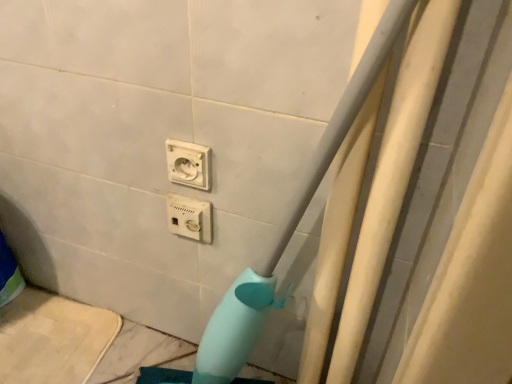
Describe the element at coordinates (189, 217) in the screenshot. I see `white plastic power plugs and sockets at center, the 2th power plugs and sockets positioned from the top` at that location.

Where is `white plastic power plugs and sockets at center, the 1th power plugs and sockets positioned from the bottom`? The height and width of the screenshot is (384, 512). white plastic power plugs and sockets at center, the 1th power plugs and sockets positioned from the bottom is located at coordinates (189, 217).

This screenshot has height=384, width=512. Identify the location of white plastic socket at center, placed as the 1th power plugs and sockets when sorted from top to bottom. tap(188, 164).

What do you see at coordinates (188, 164) in the screenshot? This screenshot has height=384, width=512. I see `white plastic socket at center, which ranks as the 2th power plugs and sockets in bottom-to-top order` at bounding box center [188, 164].

In order to face white plastic socket at center, placed as the 1th power plugs and sockets when sorted from top to bottom, should I rotate leftwards or rightwards?

You should look left and rotate roughly 9.287 degrees.

What is the approximate width of white plastic socket at center, placed as the 1th power plugs and sockets when sorted from top to bottom?

0.85 inches.

The image size is (512, 384). I want to click on white plastic power plugs and sockets at center, the 1th power plugs and sockets positioned from the bottom, so click(189, 217).

Which object is positioned more to the right, white plastic socket at center, placed as the 1th power plugs and sockets when sorted from top to bottom, or white plastic power plugs and sockets at center, the 1th power plugs and sockets positioned from the bottom?

From the viewer's perspective, white plastic socket at center, placed as the 1th power plugs and sockets when sorted from top to bottom, appears more on the right side.

Which object is closer to the camera, white plastic socket at center, placed as the 1th power plugs and sockets when sorted from top to bottom, or white plastic power plugs and sockets at center, the 1th power plugs and sockets positioned from the bottom?

Positioned in front is white plastic socket at center, placed as the 1th power plugs and sockets when sorted from top to bottom.

Does point (178, 179) appear closer or farther from the camera than point (200, 218)?

Point (178, 179) is closer to the camera than point (200, 218).

From the image's perspective, is white plastic socket at center, placed as the 1th power plugs and sockets when sorted from top to bottom, on white plastic power plugs and sockets at center, the 2th power plugs and sockets positioned from the top?

Yes, from the image's perspective, white plastic socket at center, placed as the 1th power plugs and sockets when sorted from top to bottom, is above white plastic power plugs and sockets at center, the 2th power plugs and sockets positioned from the top.

From a real-world perspective, is white plastic socket at center, which ranks as the 2th power plugs and sockets in bottom-to-top order, on top of white plastic power plugs and sockets at center, the 1th power plugs and sockets positioned from the bottom?

Yes, from a real-world perspective, white plastic socket at center, which ranks as the 2th power plugs and sockets in bottom-to-top order, is above white plastic power plugs and sockets at center, the 1th power plugs and sockets positioned from the bottom.

Considering the sizes of white plastic socket at center, which ranks as the 2th power plugs and sockets in bottom-to-top order, and white plastic power plugs and sockets at center, the 1th power plugs and sockets positioned from the bottom, in the image, is white plastic socket at center, which ranks as the 2th power plugs and sockets in bottom-to-top order, wider or thinner than white plastic power plugs and sockets at center, the 1th power plugs and sockets positioned from the bottom,?

In the image, white plastic socket at center, which ranks as the 2th power plugs and sockets in bottom-to-top order, appears to be more narrow than white plastic power plugs and sockets at center, the 1th power plugs and sockets positioned from the bottom.

Considering the relative sizes of white plastic socket at center, placed as the 1th power plugs and sockets when sorted from top to bottom, and white plastic power plugs and sockets at center, the 2th power plugs and sockets positioned from the top, in the image provided, is white plastic socket at center, placed as the 1th power plugs and sockets when sorted from top to bottom, taller than white plastic power plugs and sockets at center, the 2th power plugs and sockets positioned from the top,?

No, white plastic socket at center, placed as the 1th power plugs and sockets when sorted from top to bottom, is not taller than white plastic power plugs and sockets at center, the 2th power plugs and sockets positioned from the top.

Considering the relative sizes of white plastic socket at center, which ranks as the 2th power plugs and sockets in bottom-to-top order, and white plastic power plugs and sockets at center, the 1th power plugs and sockets positioned from the bottom, in the image provided, is white plastic socket at center, which ranks as the 2th power plugs and sockets in bottom-to-top order, smaller than white plastic power plugs and sockets at center, the 1th power plugs and sockets positioned from the bottom,?

Yes, white plastic socket at center, which ranks as the 2th power plugs and sockets in bottom-to-top order, is smaller than white plastic power plugs and sockets at center, the 1th power plugs and sockets positioned from the bottom.

Can we say white plastic socket at center, which ranks as the 2th power plugs and sockets in bottom-to-top order, lies outside white plastic power plugs and sockets at center, the 2th power plugs and sockets positioned from the top?

Indeed, white plastic socket at center, which ranks as the 2th power plugs and sockets in bottom-to-top order, is completely outside white plastic power plugs and sockets at center, the 2th power plugs and sockets positioned from the top.

Are white plastic socket at center, which ranks as the 2th power plugs and sockets in bottom-to-top order, and white plastic power plugs and sockets at center, the 2th power plugs and sockets positioned from the top, making contact?

Yes, white plastic socket at center, which ranks as the 2th power plugs and sockets in bottom-to-top order, is beside white plastic power plugs and sockets at center, the 2th power plugs and sockets positioned from the top.

From the picture: Is white plastic power plugs and sockets at center, the 2th power plugs and sockets positioned from the top, at the back of white plastic socket at center, which ranks as the 2th power plugs and sockets in bottom-to-top order?

white plastic socket at center, which ranks as the 2th power plugs and sockets in bottom-to-top order, does not have its back to white plastic power plugs and sockets at center, the 2th power plugs and sockets positioned from the top.

Locate an element on the screen. Image resolution: width=512 pixels, height=384 pixels. power plugs and sockets on the left of white plastic socket at center, placed as the 1th power plugs and sockets when sorted from top to bottom is located at coordinates (189, 217).

Considering the positions of objects white plastic power plugs and sockets at center, the 1th power plugs and sockets positioned from the bottom, and white plastic socket at center, placed as the 1th power plugs and sockets when sorted from top to bottom, in the image provided, who is more to the right, white plastic power plugs and sockets at center, the 1th power plugs and sockets positioned from the bottom, or white plastic socket at center, placed as the 1th power plugs and sockets when sorted from top to bottom,?

white plastic socket at center, placed as the 1th power plugs and sockets when sorted from top to bottom.

Is the depth of white plastic power plugs and sockets at center, the 1th power plugs and sockets positioned from the bottom, greater than that of white plastic socket at center, which ranks as the 2th power plugs and sockets in bottom-to-top order?

Yes, it is.

Which is less distant, (174, 229) or (200, 179)?

The point (200, 179) is closer to the camera.

From the image's perspective, which one is positioned lower, white plastic power plugs and sockets at center, the 2th power plugs and sockets positioned from the top, or white plastic socket at center, placed as the 1th power plugs and sockets when sorted from top to bottom?

white plastic power plugs and sockets at center, the 2th power plugs and sockets positioned from the top, from the image's perspective.

From a real-world perspective, is white plastic power plugs and sockets at center, the 2th power plugs and sockets positioned from the top, on white plastic socket at center, placed as the 1th power plugs and sockets when sorted from top to bottom?

No, from a real-world perspective, white plastic power plugs and sockets at center, the 2th power plugs and sockets positioned from the top, is not on top of white plastic socket at center, placed as the 1th power plugs and sockets when sorted from top to bottom.

Which of these two, white plastic power plugs and sockets at center, the 1th power plugs and sockets positioned from the bottom, or white plastic socket at center, placed as the 1th power plugs and sockets when sorted from top to bottom, is thinner?

white plastic socket at center, placed as the 1th power plugs and sockets when sorted from top to bottom.

Can you confirm if white plastic power plugs and sockets at center, the 1th power plugs and sockets positioned from the bottom, is taller than white plastic socket at center, placed as the 1th power plugs and sockets when sorted from top to bottom?

Yes, white plastic power plugs and sockets at center, the 1th power plugs and sockets positioned from the bottom, is taller than white plastic socket at center, placed as the 1th power plugs and sockets when sorted from top to bottom.

Can you confirm if white plastic power plugs and sockets at center, the 1th power plugs and sockets positioned from the bottom, is bigger than white plastic socket at center, which ranks as the 2th power plugs and sockets in bottom-to-top order?

Yes.

Is white plastic power plugs and sockets at center, the 2th power plugs and sockets positioned from the top, not within white plastic socket at center, which ranks as the 2th power plugs and sockets in bottom-to-top order?

Yes, white plastic power plugs and sockets at center, the 2th power plugs and sockets positioned from the top, is outside of white plastic socket at center, which ranks as the 2th power plugs and sockets in bottom-to-top order.

Is white plastic power plugs and sockets at center, the 2th power plugs and sockets positioned from the top, with white plastic socket at center, placed as the 1th power plugs and sockets when sorted from top to bottom?

Yes, white plastic power plugs and sockets at center, the 2th power plugs and sockets positioned from the top, is in contact with white plastic socket at center, placed as the 1th power plugs and sockets when sorted from top to bottom.

Is white plastic socket at center, which ranks as the 2th power plugs and sockets in bottom-to-top order, at the back of white plastic power plugs and sockets at center, the 1th power plugs and sockets positioned from the bottom?

No, white plastic power plugs and sockets at center, the 1th power plugs and sockets positioned from the bottom,'s orientation is not away from white plastic socket at center, which ranks as the 2th power plugs and sockets in bottom-to-top order.

How many degrees apart are the facing directions of white plastic power plugs and sockets at center, the 2th power plugs and sockets positioned from the top, and white plastic socket at center, which ranks as the 2th power plugs and sockets in bottom-to-top order?

The angular difference between white plastic power plugs and sockets at center, the 2th power plugs and sockets positioned from the top, and white plastic socket at center, which ranks as the 2th power plugs and sockets in bottom-to-top order, is 0.0061 degrees.

Identify the location of power plugs and sockets in front of the white plastic power plugs and sockets at center, the 2th power plugs and sockets positioned from the top. (188, 164).

You are a GUI agent. You are given a task and a screenshot of the screen. Output one action in this format:
    pyautogui.click(x=<x>, y=<y>)
    Task: Click on the power plugs and sockets that appears above the white plastic power plugs and sockets at center, the 2th power plugs and sockets positioned from the top (from the image's perspective)
    The height and width of the screenshot is (384, 512).
    Given the screenshot: What is the action you would take?
    pyautogui.click(x=188, y=164)

Identify the location of power plugs and sockets located underneath the white plastic socket at center, placed as the 1th power plugs and sockets when sorted from top to bottom (from a real-world perspective). This screenshot has height=384, width=512. (189, 217).